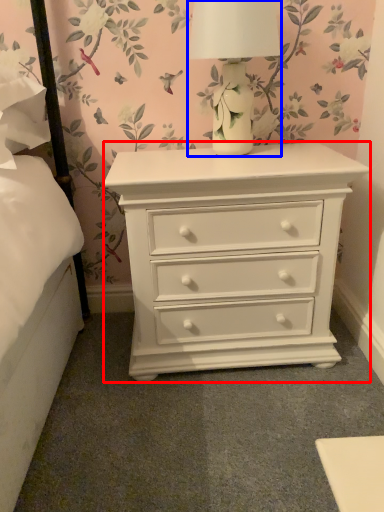
Question: Which object is further to the camera taking this photo, nightstand (highlighted by a red box) or table lamp (highlighted by a blue box)?

Choices:
 (A) nightstand
 (B) table lamp

Answer: (A)